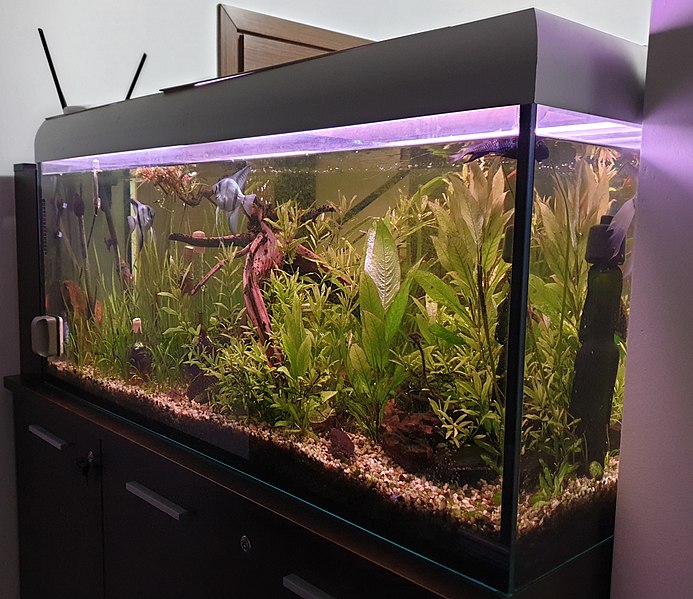
Where is `glass`? glass is located at coordinates (315, 398), (552, 355).